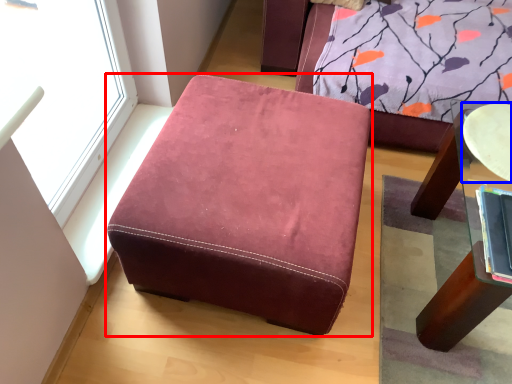
Question: Among these objects, which one is nearest to the camera, furniture (highlighted by a red box) or round table (highlighted by a blue box)?

Choices:
 (A) furniture
 (B) round table

Answer: (A)